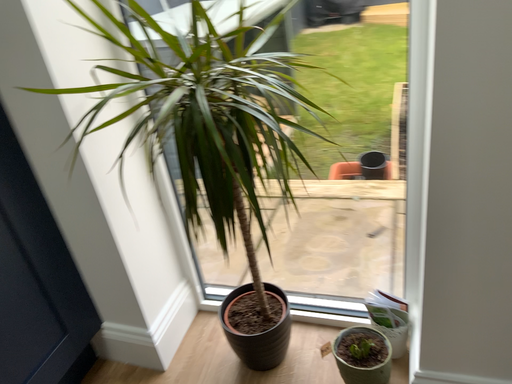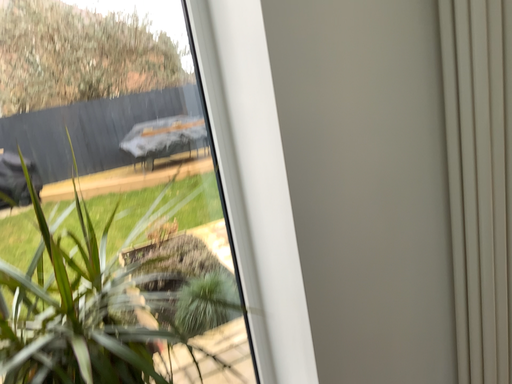
Question: How did the camera likely rotate when shooting the video?

Choices:
 (A) rotated left
 (B) rotated right

Answer: (B)